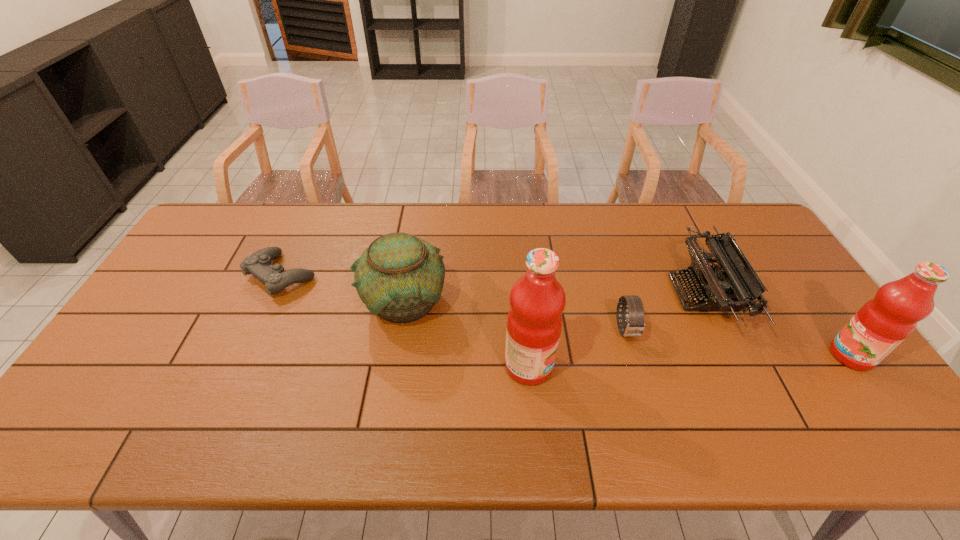
Where is `the second object from right to left`? the second object from right to left is located at coordinates (732, 285).

Where is `typewriter`? The height and width of the screenshot is (540, 960). typewriter is located at coordinates (732, 285).

Where is `free space located on the front label of the tallest object`? free space located on the front label of the tallest object is located at coordinates (659, 366).

Where is `free spot located on the front label of the rightmost object`? free spot located on the front label of the rightmost object is located at coordinates (797, 355).

Identify the location of vacant area situated 0.090m on the front label of the rightmost object. Image resolution: width=960 pixels, height=540 pixels. pyautogui.click(x=797, y=355).

Image resolution: width=960 pixels, height=540 pixels. Find the location of `vacant area situated on the front label of the rightmost object`. vacant area situated on the front label of the rightmost object is located at coordinates (739, 355).

In order to click on vacant space located 0.150m on the right of the leftmost object in this screenshot , I will do `click(366, 275)`.

At what (x,y) coordinates should I click in order to perform the action: click on free space located on the face of the third object from right to left. Please return your answer as a coordinate pair (x, y). The height and width of the screenshot is (540, 960). Looking at the image, I should click on (643, 389).

Locate an element on the screen. The height and width of the screenshot is (540, 960). vacant space situated 0.220m on the right of the third tallest object is located at coordinates (522, 300).

Identify the location of vacant area situated on the typing side of the third shortest object. The height and width of the screenshot is (540, 960). (647, 294).